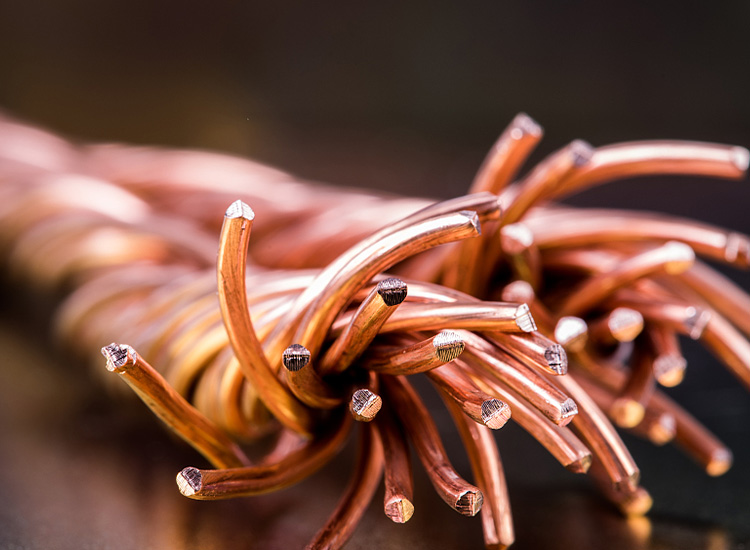
The height and width of the screenshot is (550, 750). In order to click on table in this screenshot , I will do `click(676, 533)`.